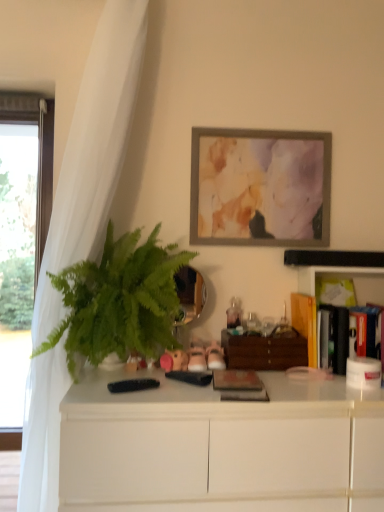
At what (x,y) coordinates should I click in order to perform the action: click on green leafy plant at left. Please return your answer as a coordinate pair (x, y). Looking at the image, I should click on (119, 300).

In order to face hardcover book at right, which appears as the 2th book when viewed from the front, should I rotate leftwards or rightwards?

It's best to rotate right around 20.088 degrees.

The image size is (384, 512). I want to click on white sheer curtain at left, so click(92, 153).

Find the location of a particular element. The width and height of the screenshot is (384, 512). rustic wooden book at center, arranged as the 1th book when viewed from the front is located at coordinates (239, 385).

Identify the location of wooden drawer at center. (264, 351).

I want to click on matte gray picture frame at upper center, so click(x=260, y=187).

Find the location of a particular element. This screenshot has width=384, height=512. green leafy plant at left is located at coordinates (119, 300).

Looking at their sizes, would you say hardcover book at right, the 1th book in the right-to-left sequence, is wider or thinner than white matte cabinet at center?

hardcover book at right, the 1th book in the right-to-left sequence, is thinner than white matte cabinet at center.

Between hardcover book at right, the 1th book in the right-to-left sequence, and white matte cabinet at center, which one is positioned in front?

white matte cabinet at center is more forward.

Based on the photo, from the image's perspective, is hardcover book at right, the 1th book in the right-to-left sequence, on white matte cabinet at center?

Yes.

Can you confirm if hardcover book at right, which appears as the 2th book when viewed from the front, is positioned to the left of white matte cabinet at center?

In fact, hardcover book at right, which appears as the 2th book when viewed from the front, is to the right of white matte cabinet at center.

What are the coordinates of `houseplant that is above the hardcover book at right, which ranks as the 3th book in left-to-right order (from the image's perspective)` in the screenshot? It's located at (119, 300).

Is green leafy plant at left taller or shorter than hardcover book at right, which appears as the 2th book when viewed from the front?

Clearly, green leafy plant at left is taller compared to hardcover book at right, which appears as the 2th book when viewed from the front.

Does green leafy plant at left contain hardcover book at right, arranged as the second book when viewed from the back?

That's incorrect, hardcover book at right, arranged as the second book when viewed from the back, is not inside green leafy plant at left.

Is green leafy plant at left oriented towards hardcover book at right, which ranks as the 3th book in left-to-right order?

No, green leafy plant at left does not turn towards hardcover book at right, which ranks as the 3th book in left-to-right order.

In the image, there is a matte gray picture frame at upper center. Where is `file cabinet below it (from a real-world perspective)`? file cabinet below it (from a real-world perspective) is located at coordinates (264, 351).

Is wooden drawer at center far away from matte gray picture frame at upper center?

wooden drawer at center is near matte gray picture frame at upper center, not far away.

Is wooden drawer at center oriented away from matte gray picture frame at upper center?

No.

Can you confirm if wooden drawer at center is smaller than matte gray picture frame at upper center?

Yes, wooden drawer at center is smaller than matte gray picture frame at upper center.

Is wooden drawer at center not close to wooden book at right, the first book positioned from the back?

Actually, wooden drawer at center and wooden book at right, the first book positioned from the back, are a little close together.

From a real-world perspective, is wooden drawer at center located higher than wooden book at right, the 3th book viewed from the front?

No, from a real-world perspective, wooden drawer at center is not above wooden book at right, the 3th book viewed from the front.

From the image's perspective, is wooden drawer at center under wooden book at right, which ranks as the 2th book in left-to-right order?

Yes, from the image's perspective, wooden drawer at center is below wooden book at right, which ranks as the 2th book in left-to-right order.

Considering the sizes of objects wooden drawer at center and wooden book at right, the 3th book viewed from the front, in the image provided, who is taller, wooden drawer at center or wooden book at right, the 3th book viewed from the front,?

Standing taller between the two is wooden book at right, the 3th book viewed from the front.

Which object is positioned more to the left, white matte cabinet at center or green leafy plant at left?

green leafy plant at left is more to the left.

Considering the positions of objects white matte cabinet at center and green leafy plant at left in the image provided, who is in front, white matte cabinet at center or green leafy plant at left?

white matte cabinet at center.

Considering the positions of points (198, 461) and (118, 266), is point (198, 461) closer to camera compared to point (118, 266)?

Yes, it is in front of point (118, 266).

Is white matte cabinet at center bigger or smaller than green leafy plant at left?

white matte cabinet at center is bigger than green leafy plant at left.

Is wooden drawer at center looking in the opposite direction of hardcover book at right, arranged as the second book when viewed from the back?

No, wooden drawer at center is not facing away from hardcover book at right, arranged as the second book when viewed from the back.

Can you tell me how much wooden drawer at center and hardcover book at right, the 1th book in the right-to-left sequence, differ in facing direction?

The facing directions of wooden drawer at center and hardcover book at right, the 1th book in the right-to-left sequence, are 0.963 degrees apart.

Considering the relative positions of wooden drawer at center and hardcover book at right, arranged as the second book when viewed from the back, in the image provided, is wooden drawer at center to the left or to the right of hardcover book at right, arranged as the second book when viewed from the back,?

wooden drawer at center is to the left of hardcover book at right, arranged as the second book when viewed from the back.

Would you say wooden drawer at center is outside hardcover book at right, arranged as the second book when viewed from the back?

Yes, wooden drawer at center is outside of hardcover book at right, arranged as the second book when viewed from the back.

Is green leafy plant at left thinner than wooden book at right, the first book positioned from the back?

No.

Considering their positions, is green leafy plant at left located in front of or behind wooden book at right, the 2th book from the right?

Clearly, green leafy plant at left is in front of wooden book at right, the 2th book from the right.

Does green leafy plant at left have a larger size compared to wooden book at right, the first book positioned from the back?

Yes.

Which book is the 2nd one when counting from the back of the white matte cabinet at center? Please provide its 2D coordinates.

[(347, 333)]

From a real-world perspective, which book is the 2nd one underneath the green leafy plant at left? Please provide its 2D coordinates.

[(347, 333)]

From the image, which object appears to be nearer to white sheer curtain at left, pink fabric stuffed animal at center or matte gray picture frame at upper center?

matte gray picture frame at upper center lies closer to white sheer curtain at left than the other object.

Looking at the image, which one is located closer to rustic wooden book at center, arranged as the 1th book when viewed from the front, pink fabric stuffed animal at center or green leafy plant at left?

pink fabric stuffed animal at center is closer to rustic wooden book at center, arranged as the 1th book when viewed from the front.

From the image, which object appears to be nearer to wooden book at right, the first book positioned from the back, green leafy plant at left or wooden drawer at center?

The object closer to wooden book at right, the first book positioned from the back, is wooden drawer at center.

Based on their spatial positions, is rustic wooden book at center, arranged as the 1th book when viewed from the front, or pink fabric stuffed animal at center closer to wooden book at right, the 3th book viewed from the front?

rustic wooden book at center, arranged as the 1th book when viewed from the front.

Looking at the image, which one is located closer to rustic wooden book at center, which ranks as the third book in back-to-front order, wooden book at right, the first book positioned from the back, or white sheer curtain at left?

wooden book at right, the first book positioned from the back, is closer to rustic wooden book at center, which ranks as the third book in back-to-front order.

When comparing their distances from pink fabric stuffed animal at center, does wooden drawer at center or hardcover book at right, the 1th book in the right-to-left sequence, seem further?

Among the two, hardcover book at right, the 1th book in the right-to-left sequence, is located further to pink fabric stuffed animal at center.

Based on the photo, from the image, which object appears to be farther from matte gray picture frame at upper center, hardcover book at right, which appears as the 2th book when viewed from the front, or green leafy plant at left?

hardcover book at right, which appears as the 2th book when viewed from the front.

From the image, which object appears to be farther from wooden book at right, which ranks as the 2th book in left-to-right order, white sheer curtain at left or green leafy plant at left?

white sheer curtain at left lies further to wooden book at right, which ranks as the 2th book in left-to-right order, than the other object.

Find the location of a particular element. toy between white sheer curtain at left and rustic wooden book at center, acting as the third book starting from the right, in the horizontal direction is located at coordinates (174, 360).

I want to click on file cabinet located between white sheer curtain at left and matte gray picture frame at upper center in the left-right direction, so click(x=264, y=351).

The width and height of the screenshot is (384, 512). In order to click on houseplant that lies between matte gray picture frame at upper center and rustic wooden book at center, acting as the third book starting from the right, from top to bottom in this screenshot , I will do `click(119, 300)`.

The image size is (384, 512). I want to click on toy located between white matte cabinet at center and wooden drawer at center in the depth direction, so click(174, 360).